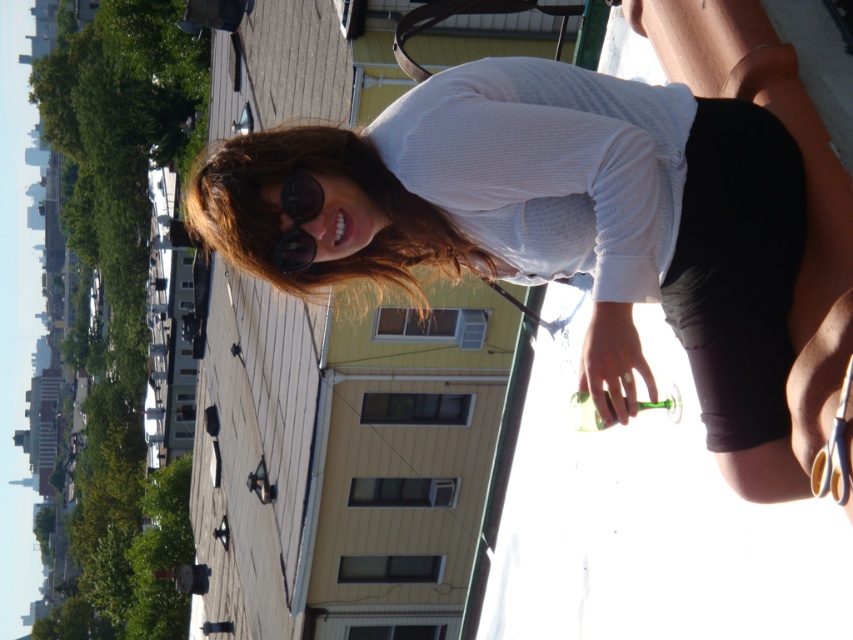
You are a fashion designer observing the rooftop scene. You notice the white textured shirt at upper center and the transparent dark blue sunglasses at upper center. Which item is positioned more to the right?

The white textured shirt at upper center is positioned to the right of the transparent dark blue sunglasses at upper center, so the white textured shirt at upper center is more to the right.

You are a fashion designer observing the rooftop scene. You notice the white textured shirt at upper center and the transparent dark blue sunglasses at upper center. Which clothing item is closer to the top of the person?

The transparent dark blue sunglasses at upper center are closer to the top of the person since the white textured shirt at upper center is positioned under them.

In the scene shown: You are a fashion designer observing the rooftop scene. You notice the white textured shirt at upper center and the transparent dark blue sunglasses at upper center. Which clothing accessory is positioned higher on the person?

The white textured shirt at upper center is taller than transparent dark blue sunglasses at upper center, so the white textured shirt at upper center is positioned higher on the person.